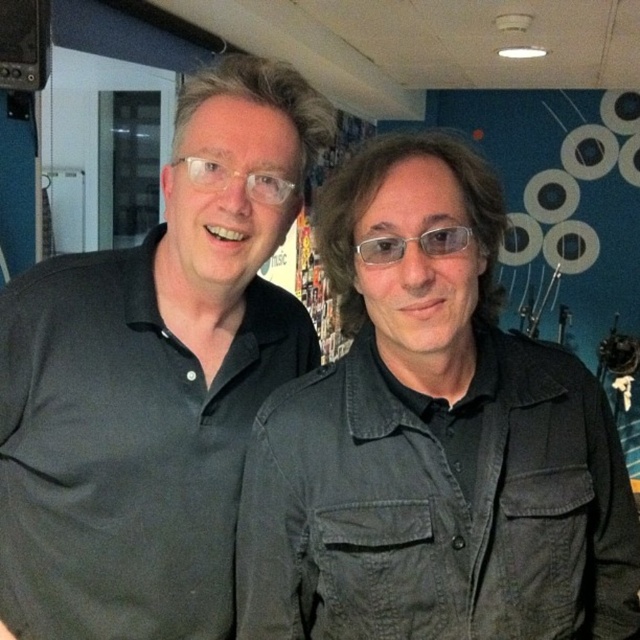
In the scene shown: You are a photographer setting up a shoot in this room. You need to ensure that both the matte black jacket at center and the dark gray shirt at center can fit within the camera frame. Given that the camera frame can accommodate a width of 1.2 meters, will both items fit if placed side by side?

The matte black jacket at center is wider than the dark gray shirt at center. Since the camera frame can only accommodate 1.2 meters, the combined width of both items may exceed the frame capacity. To confirm, you need to know the exact widths of both items.

You are a photographer setting up for a portrait shoot in the studio. You notice the matte black jacket at center and the transparent plastic glasses at center. Which object should you adjust first to ensure they are both in frame? Explain your reasoning.

The transparent plastic glasses at center should be adjusted first because they are positioned above the matte black jacket at center, so moving them might affect the jacket below. Adjusting the jacket first could displace the glasses since they are placed on top of it.